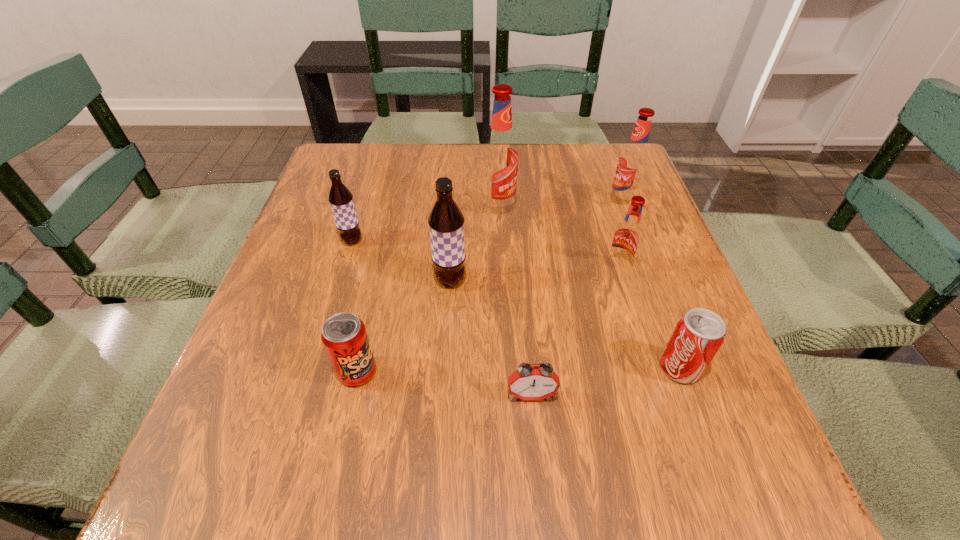
This screenshot has height=540, width=960. Find the location of `the right red soda can`. the right red soda can is located at coordinates (699, 333).

Where is `the left red soda can`? This screenshot has height=540, width=960. the left red soda can is located at coordinates (344, 336).

You are a GUI agent. You are given a task and a screenshot of the screen. Output one action in this format:
    pyautogui.click(x=<x>, y=<y>)
    Task: Click on the left soda can
    This screenshot has width=960, height=540.
    Given the screenshot: What is the action you would take?
    pyautogui.click(x=344, y=336)

This screenshot has width=960, height=540. Find the location of `the shortest object`. the shortest object is located at coordinates (535, 383).

You are a GUI agent. You are given a task and a screenshot of the screen. Output one action in this format:
    pyautogui.click(x=<x>, y=<y>)
    Task: Click on the vacant space located on the left of the biggest red root beer
    The width and height of the screenshot is (960, 540).
    Given the screenshot: What is the action you would take?
    pyautogui.click(x=382, y=210)

Identify the location of vacant region located on the front of the rightmost root beer. (635, 239).

Image resolution: width=960 pixels, height=540 pixels. What are the coordinates of `free space located on the back of the second root beer from left to right` in the screenshot? It's located at (457, 174).

At what (x,y) coordinates should I click in order to perform the action: click on free space located on the left of the nearest red root beer. Please return your answer as a coordinate pair (x, y). The image size is (960, 540). Looking at the image, I should click on (516, 268).

In order to click on vacant space situated on the back of the leftmost object in this screenshot , I will do `click(380, 150)`.

Find the location of `vacant area located 0.150m on the left of the right red soda can`. vacant area located 0.150m on the left of the right red soda can is located at coordinates (572, 368).